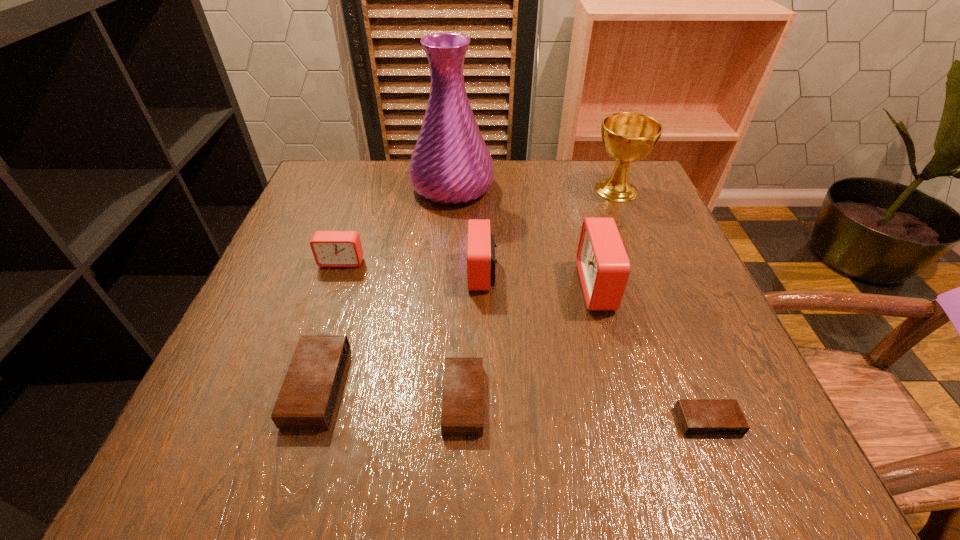
Locate which alarm clock is the sixth closest to the vase. Please provide its 2D coordinates. Your answer should be formatted as a tuple, i.e. [(x, y)], where the tuple contains the x and y coordinates of a point satisfying the conditions above.

[(696, 416)]

Identify which alarm clock is the second closest to the second tallest alarm clock. Please provide its 2D coordinates. Your answer should be formatted as a tuple, i.e. [(x, y)], where the tuple contains the x and y coordinates of a point satisfying the conditions above.

[(462, 406)]

Where is `red alarm clock that is the second closest to the second red alarm clock from right to left`? This screenshot has width=960, height=540. red alarm clock that is the second closest to the second red alarm clock from right to left is located at coordinates (330, 248).

Identify the location of the third closest red alarm clock to the smallest black alarm clock. (330, 248).

Identify the location of the closest black alarm clock relative to the fifth shortest object. (462, 406).

The width and height of the screenshot is (960, 540). In order to click on black alarm clock that is the closest to the chalice in this screenshot , I will do `click(696, 416)`.

At what (x,y) coordinates should I click in order to perform the action: click on free spot that satisfies the following two spatial constraints: 1. on the front side of the seventh shortest object; 2. on the front-facing side of the second tallest alarm clock. Please return your answer as a coordinate pair (x, y). Looking at the image, I should click on (650, 273).

At what (x,y) coordinates should I click in order to perform the action: click on vacant position in the image that satisfies the following two spatial constraints: 1. on the front side of the gold chalice; 2. on the front-facing side of the biggest red alarm clock. Please return your answer as a coordinate pair (x, y). Image resolution: width=960 pixels, height=540 pixels. Looking at the image, I should click on (655, 286).